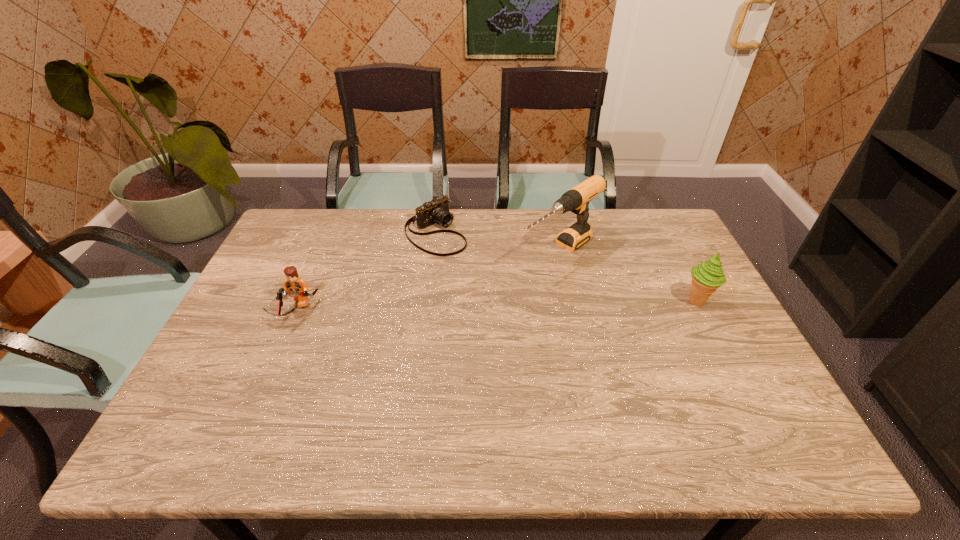
Identify the location of vacant space located on the handle side of the drill. The height and width of the screenshot is (540, 960). tap(485, 303).

Locate an element on the screen. Image resolution: width=960 pixels, height=540 pixels. vacant position located 0.050m on the handle side of the drill is located at coordinates (521, 278).

The image size is (960, 540). Find the location of `vacant space situated on the handle side of the drill`. vacant space situated on the handle side of the drill is located at coordinates (516, 281).

At what (x,y) coordinates should I click in order to perform the action: click on vacant space situated 0.320m on the front-facing side of the shortest object. Please return your answer as a coordinate pair (x, y). The height and width of the screenshot is (540, 960). Looking at the image, I should click on (529, 303).

At what (x,y) coordinates should I click in order to perform the action: click on blank space located 0.230m on the front-facing side of the shortest object. Please return your answer as a coordinate pair (x, y). Looking at the image, I should click on (506, 287).

The width and height of the screenshot is (960, 540). Find the location of `free region located 0.390m on the front-facing side of the shortest object`. free region located 0.390m on the front-facing side of the shortest object is located at coordinates (547, 318).

Where is `drill that is at the far edge`? The height and width of the screenshot is (540, 960). drill that is at the far edge is located at coordinates (576, 200).

You are a GUI agent. You are given a task and a screenshot of the screen. Output one action in this format:
    pyautogui.click(x=<x>, y=<y>)
    Task: Click on the camera at the far edge
    This screenshot has height=540, width=960.
    Given the screenshot: What is the action you would take?
    pyautogui.click(x=436, y=211)

Image resolution: width=960 pixels, height=540 pixels. In order to click on object present at the left edge in this screenshot , I will do `click(294, 285)`.

You are a GUI agent. You are given a task and a screenshot of the screen. Output one action in this format:
    pyautogui.click(x=<x>, y=<y>)
    Task: Click on the object located at the right edge
    
    Given the screenshot: What is the action you would take?
    pyautogui.click(x=706, y=277)